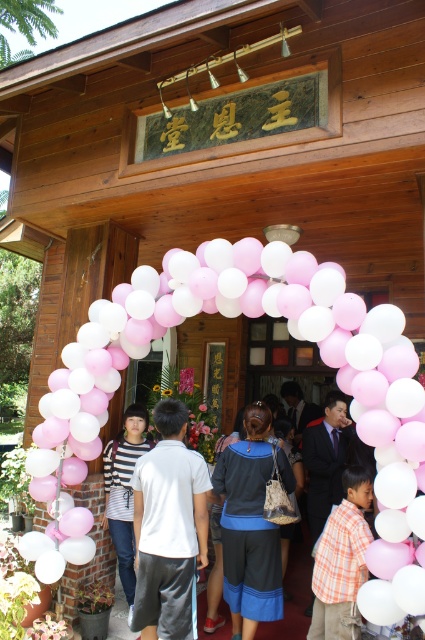
Question: Is pink matte balloons at center to the left of orange plaid shirt at center from the viewer's perspective?

Choices:
 (A) yes
 (B) no

Answer: (A)

Question: Considering the real-world distances, which object is farthest from the orange plaid shirt at center?

Choices:
 (A) white cotton shirt at center
 (B) dark gray fabric shorts at center
 (C) pink matte balloons at center

Answer: (C)

Question: Is pink matte balloons at center smaller than white cotton shirt at center?

Choices:
 (A) no
 (B) yes

Answer: (A)

Question: Can you confirm if pink matte balloons at center is wider than dark gray fabric shorts at center?

Choices:
 (A) no
 (B) yes

Answer: (B)

Question: Considering the real-world distances, which object is farthest from the pink matte balloons at center?

Choices:
 (A) dark gray fabric shorts at center
 (B) orange plaid shirt at center
 (C) white cotton shirt at center
 (D) striped fabric shirt at center

Answer: (D)

Question: Estimate the real-world distances between objects in this image. Which object is farther from the striped fabric shirt at center?

Choices:
 (A) white cotton shirt at center
 (B) pink matte balloons at center
 (C) orange plaid shirt at center

Answer: (C)